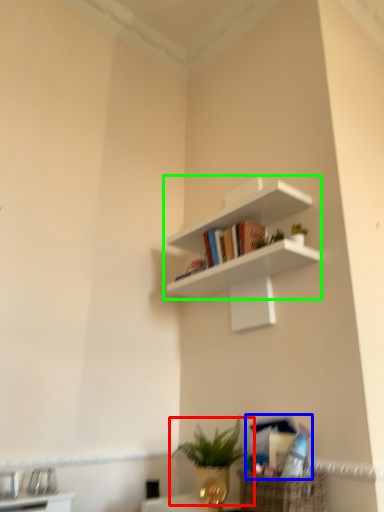
Question: Which is farther away from houseplant (highlighted by a red box)? book (highlighted by a blue box) or shelf (highlighted by a green box)?

Choices:
 (A) book
 (B) shelf

Answer: (B)